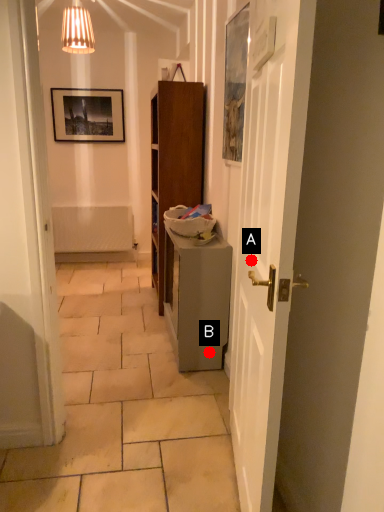
Question: Two points are circled on the image, labeled by A and B beside each circle. Which point is further to the camera?

Choices:
 (A) A is further
 (B) B is further

Answer: (B)